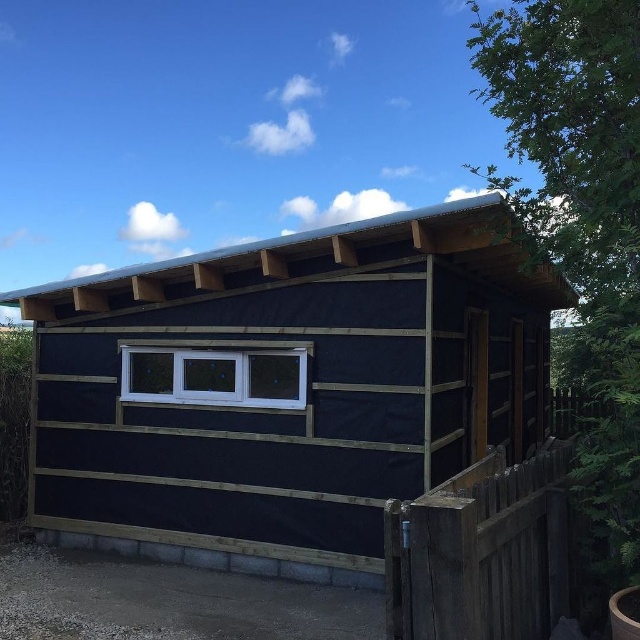
You are standing in front of the black wood hut at center and the white plastic window at center. Which object is positioned to the left of the other?

The black wood hut at center is positioned to the left of the white plastic window at center.

You are standing outside the cabin and want to look through the white plastic window at center. Can you see the weathered wood fence at right through the window?

The weathered wood fence at right is in front of the white plastic window at center, so you cannot see it through the window because the fence blocks the view.

You are standing outside the black wood hut at center and want to look through the white plastic window at center. Can you see the window from your current position?

The black wood hut at center is above the white plastic window at center, so yes, you can see the white plastic window at center from your current position outside the black wood hut at center.